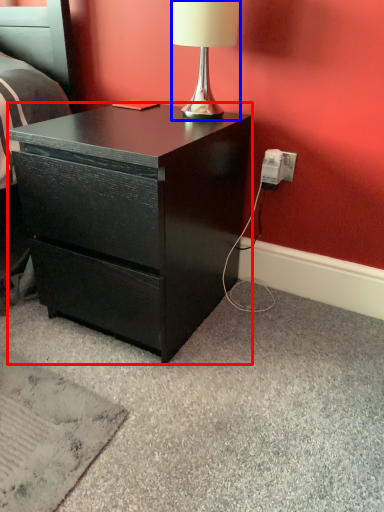
Question: Which object is closer to the camera taking this photo, desk (highlighted by a red box) or lamp (highlighted by a blue box)?

Choices:
 (A) desk
 (B) lamp

Answer: (A)